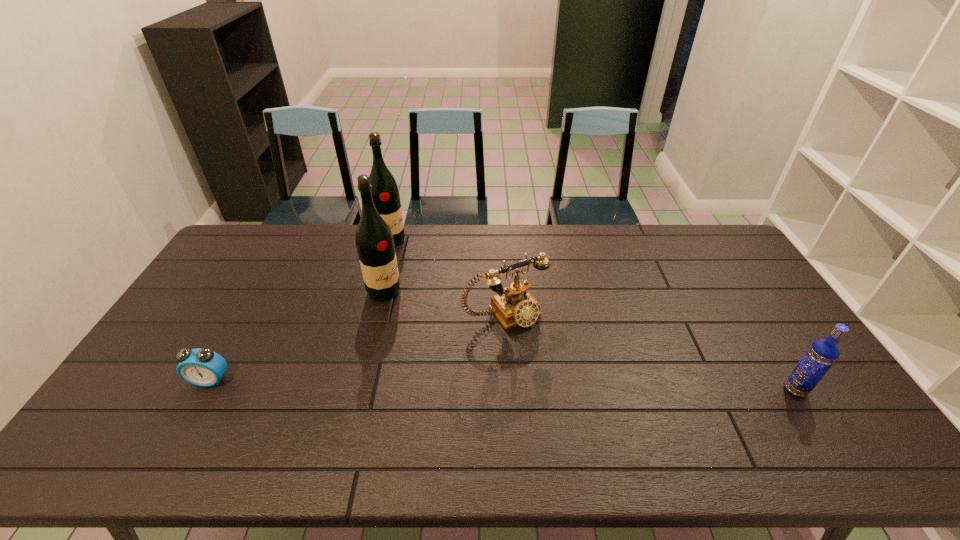
The height and width of the screenshot is (540, 960). I want to click on free space between the farther liquor and the leftmost object, so click(300, 310).

Identify the location of free spot between the third shortest object and the second object from right to left. (650, 351).

I want to click on free space between the nearer liquor and the vodka, so click(589, 341).

Identify the location of free spot between the shortest object and the second object from right to left. The height and width of the screenshot is (540, 960). (357, 346).

Where is `free spot between the farthest object and the rightmost object`? Image resolution: width=960 pixels, height=540 pixels. free spot between the farthest object and the rightmost object is located at coordinates (593, 315).

The image size is (960, 540). I want to click on free space between the nearer liquor and the third shortest object, so click(x=589, y=341).

At what (x,y) coordinates should I click in order to perform the action: click on free space between the fourth tallest object and the third tallest object. Please return your answer as a coordinate pair (x, y). This screenshot has width=960, height=540. Looking at the image, I should click on (650, 351).

You are a GUI agent. You are given a task and a screenshot of the screen. Output one action in this format:
    pyautogui.click(x=<x>, y=<y>)
    Task: Click on the object that stands as the fourth closest to the shortest object
    The height and width of the screenshot is (540, 960).
    Given the screenshot: What is the action you would take?
    pyautogui.click(x=822, y=354)

Where is `the second closest object relative to the rightmost object`? The width and height of the screenshot is (960, 540). the second closest object relative to the rightmost object is located at coordinates coord(375,246).

Image resolution: width=960 pixels, height=540 pixels. What are the coordinates of `free space that satisfies the following two spatial constraints: 1. on the front side of the farthest object; 2. on the right side of the third tallest object` in the screenshot? It's located at (352, 390).